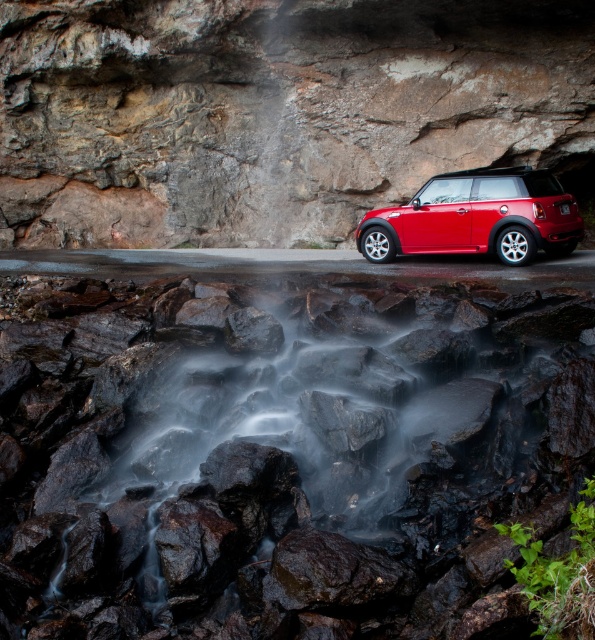
Question: Considering the relative positions of matte rock cliff at upper center and glossy metallic car at center in the image provided, where is matte rock cliff at upper center located with respect to glossy metallic car at center?

Choices:
 (A) left
 (B) right

Answer: (A)

Question: Does matte rock cliff at upper center have a larger size compared to glossy metallic car at center?

Choices:
 (A) no
 (B) yes

Answer: (B)

Question: Estimate the real-world distances between objects in this image. Which object is farther from the glossy rock at center?

Choices:
 (A) glossy metallic car at center
 (B) matte rock cliff at upper center

Answer: (B)

Question: Among these points, which one is nearest to the camera?

Choices:
 (A) (515, 86)
 (B) (336, 516)
 (C) (452, 248)

Answer: (B)

Question: Is matte rock cliff at upper center behind glossy metallic car at center?

Choices:
 (A) yes
 (B) no

Answer: (A)

Question: Which point is closer to the camera?

Choices:
 (A) matte rock cliff at upper center
 (B) glossy metallic car at center
 (C) glossy rock at center

Answer: (C)